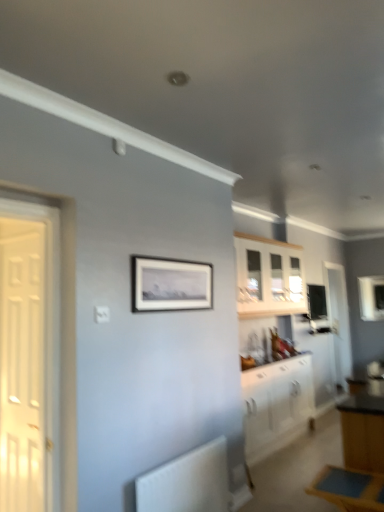
Question: Considering the relative positions of white matte radiator at lower left and clear glass window at upper right in the image provided, is white matte radiator at lower left to the right of clear glass window at upper right from the viewer's perspective?

Choices:
 (A) yes
 (B) no

Answer: (B)

Question: Considering the relative sizes of white matte radiator at lower left and clear glass window at upper right in the image provided, is white matte radiator at lower left thinner than clear glass window at upper right?

Choices:
 (A) yes
 (B) no

Answer: (B)

Question: Is white matte radiator at lower left positioned beyond the bounds of clear glass window at upper right?

Choices:
 (A) no
 (B) yes

Answer: (B)

Question: Is white matte radiator at lower left oriented away from clear glass window at upper right?

Choices:
 (A) no
 (B) yes

Answer: (A)

Question: From a real-world perspective, is white matte radiator at lower left physically above clear glass window at upper right?

Choices:
 (A) no
 (B) yes

Answer: (A)

Question: Is white matte radiator at lower left next to clear glass window at upper right?

Choices:
 (A) no
 (B) yes

Answer: (A)

Question: Considering the relative sizes of white matte radiator at lower left and white wood cabinet at upper center, the second cabinetry when ordered from bottom to top, in the image provided, is white matte radiator at lower left smaller than white wood cabinet at upper center, the second cabinetry when ordered from bottom to top,?

Choices:
 (A) yes
 (B) no

Answer: (A)

Question: From the image's perspective, is white matte radiator at lower left located above white wood cabinet at upper center, the second cabinetry when ordered from bottom to top?

Choices:
 (A) no
 (B) yes

Answer: (A)

Question: Considering the relative sizes of white matte radiator at lower left and white wood cabinet at upper center, the second cabinetry when ordered from bottom to top, in the image provided, is white matte radiator at lower left shorter than white wood cabinet at upper center, the second cabinetry when ordered from bottom to top,?

Choices:
 (A) no
 (B) yes

Answer: (B)

Question: Is white matte radiator at lower left positioned before white wood cabinet at upper center, which appears as the 1th cabinetry when viewed from the top?

Choices:
 (A) no
 (B) yes

Answer: (B)

Question: Does white matte radiator at lower left contain white wood cabinet at upper center, the second cabinetry when ordered from bottom to top?

Choices:
 (A) yes
 (B) no

Answer: (B)

Question: Is white matte radiator at lower left located outside white wood cabinet at upper center, which appears as the 1th cabinetry when viewed from the top?

Choices:
 (A) yes
 (B) no

Answer: (A)

Question: Considering the relative sizes of white wooden door at left, which is the second door from right to left, and white glossy cabinet at lower right, the 1th cabinetry from the bottom, in the image provided, is white wooden door at left, which is the second door from right to left, bigger than white glossy cabinet at lower right, the 1th cabinetry from the bottom,?

Choices:
 (A) no
 (B) yes

Answer: (A)